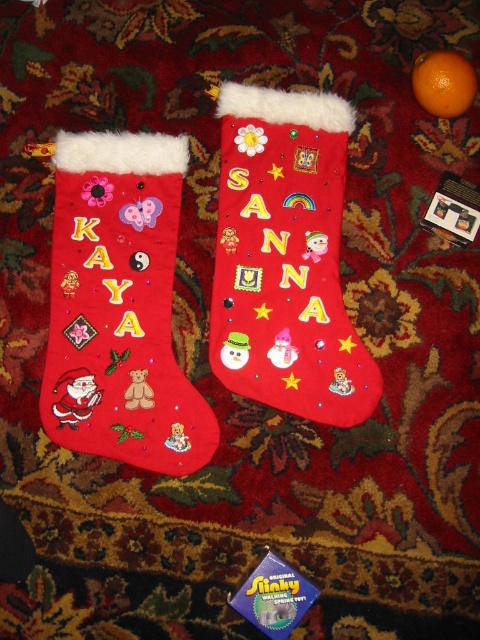
From the picture: Between felt/embroidered stocking at center and orangesmoothorange at upper right, which one appears on the left side from the viewer's perspective?

Positioned to the left is felt/embroidered stocking at center.

Can you confirm if felt/embroidered stocking at center is thinner than orangesmoothorange at upper right?

No, felt/embroidered stocking at center is not thinner than orangesmoothorange at upper right.

Measure the distance between point (368, 356) and camera.

The distance of point (368, 356) from camera is 4.25 feet.

This screenshot has width=480, height=640. What are the coordinates of `felt/embroidered stocking at center` in the screenshot? It's located at (286, 257).

Does matte red stocking at left have a lesser height compared to orangesmoothorange at upper right?

No.

Is point (166, 204) in front of point (423, 92)?

No, it is not.

At what (x,y) coordinates should I click in order to perform the action: click on matte red stocking at left. Please return your answer as a coordinate pair (x, y). Looking at the image, I should click on (120, 305).

Which of these two, matte red stocking at left or felt/embroidered stocking at center, stands shorter?

matte red stocking at left is shorter.

Can you confirm if matte red stocking at left is positioned to the left of felt/embroidered stocking at center?

Correct, you'll find matte red stocking at left to the left of felt/embroidered stocking at center.

Find the location of a particular element. matte red stocking at left is located at coordinates (120, 305).

You are a GUI agent. You are given a task and a screenshot of the screen. Output one action in this format:
    pyautogui.click(x=<x>, y=<y>)
    Task: Click on the matte red stocking at left
    This screenshot has height=640, width=480.
    Given the screenshot: What is the action you would take?
    pyautogui.click(x=120, y=305)